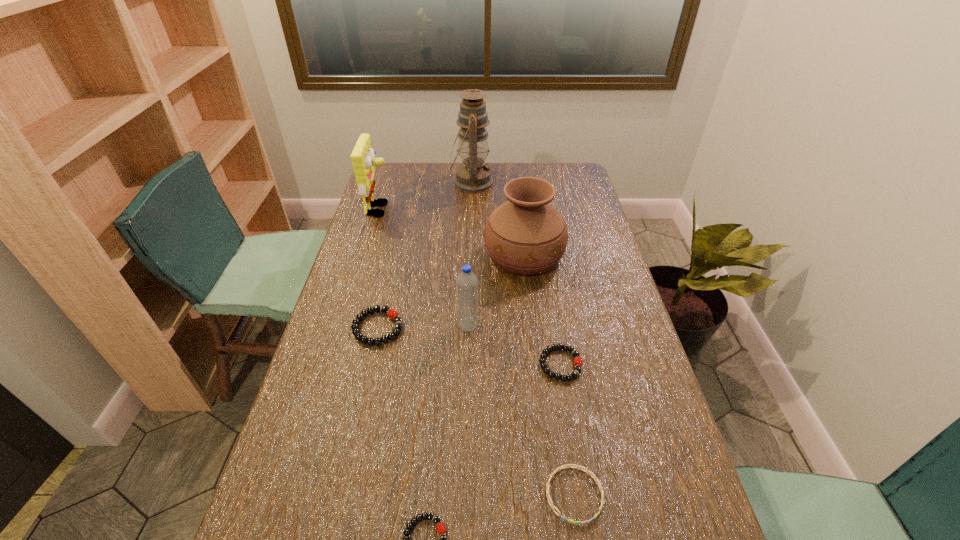
Locate an element on the screen. Image resolution: width=960 pixels, height=540 pixels. vacant space located 0.280m on the left of the brown oil lamp is located at coordinates (383, 183).

This screenshot has height=540, width=960. I want to click on vacant space located 0.230m on the face of the sponge, so click(451, 210).

Where is `free space located on the front of the third farthest object`? free space located on the front of the third farthest object is located at coordinates (538, 367).

This screenshot has height=540, width=960. I want to click on vacant region located on the front of the fifth shortest object, so click(468, 350).

You are a GUI agent. You are given a task and a screenshot of the screen. Output one action in this format:
    pyautogui.click(x=<x>, y=<y>)
    Task: Click on the vacant position located 0.160m on the back of the leftmost black bracelet
    This screenshot has width=960, height=540.
    Given the screenshot: What is the action you would take?
    pyautogui.click(x=391, y=273)

This screenshot has height=540, width=960. I want to click on free space located on the left of the second smallest black bracelet, so click(x=464, y=364).

Locate an element on the screen. The width and height of the screenshot is (960, 540). object at the far edge is located at coordinates click(x=473, y=176).

Image resolution: width=960 pixels, height=540 pixels. I want to click on sponge at the left edge, so click(x=363, y=159).

The image size is (960, 540). Identify the location of bracelet at the left edge. (392, 314).

What are the coordinates of `object that is at the right edge` in the screenshot? It's located at tap(526, 235).